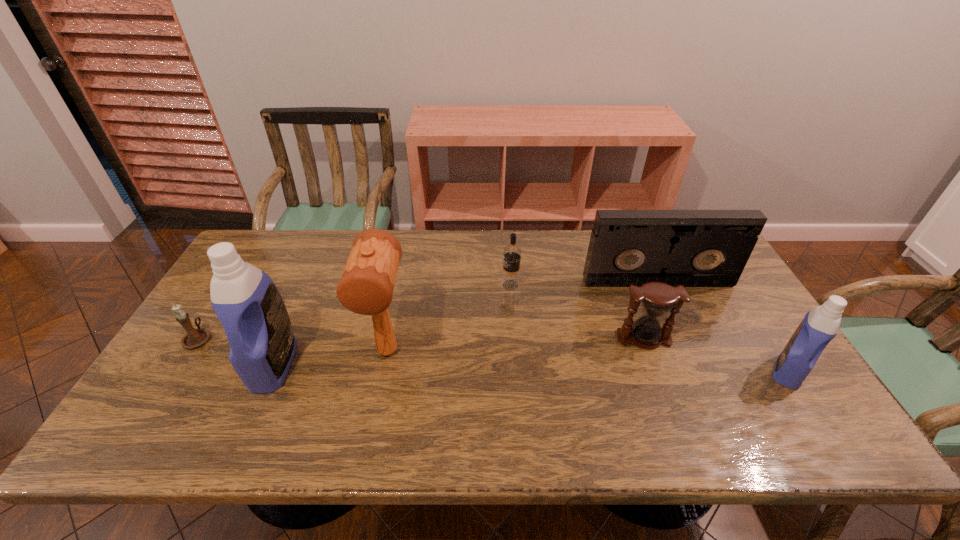
The image size is (960, 540). I want to click on vacant space located 0.100m on the left of the right detergent, so click(x=728, y=371).

I want to click on vacant space located on the back of the hourglass, so click(x=612, y=254).

What are the coordinates of `vacant space located 0.180m on the label of the fourth object from left to right` in the screenshot? It's located at (443, 285).

Where is `free space located on the label of the fourth object from left to right`? This screenshot has width=960, height=540. free space located on the label of the fourth object from left to right is located at coordinates (466, 285).

Find the location of a particular element. vacant space located 0.210m on the label of the fourth object from left to right is located at coordinates (433, 285).

At what (x,y) coordinates should I click in order to perform the action: click on free spot located on the front side of the videotape. Please return your answer as a coordinate pair (x, y). The image size is (960, 540). Looking at the image, I should click on (686, 345).

This screenshot has height=540, width=960. I want to click on free region located on the strike surface of the mallet, so click(377, 402).

Where is `free spot located 0.280m on the side of the shortest object with the handle`? Image resolution: width=960 pixels, height=540 pixels. free spot located 0.280m on the side of the shortest object with the handle is located at coordinates (246, 263).

Locate an element on the screen. The height and width of the screenshot is (540, 960). free space located on the side of the shortest object with the handle is located at coordinates (231, 285).

This screenshot has height=540, width=960. I want to click on vacant space located 0.120m on the side of the shortest object with the handle, so click(225, 296).